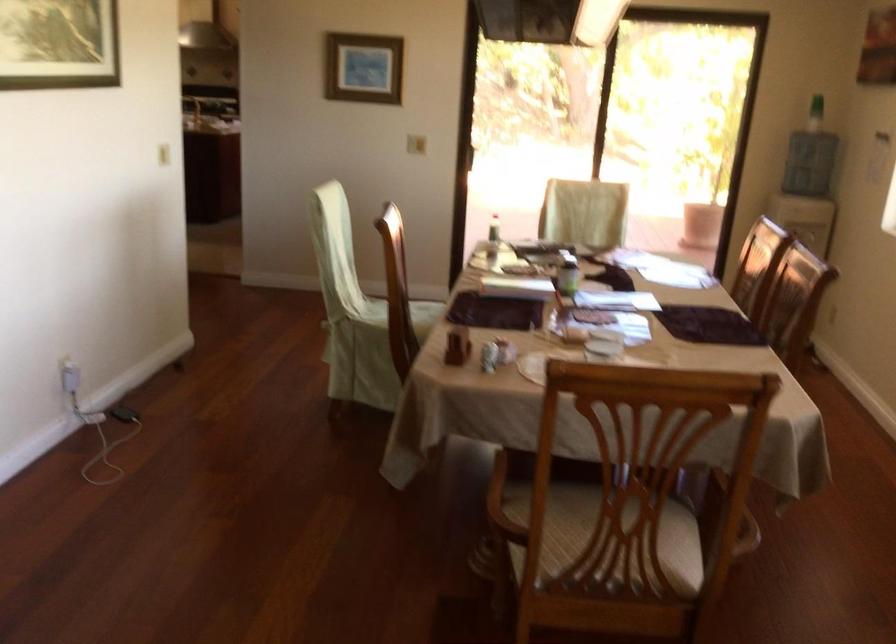
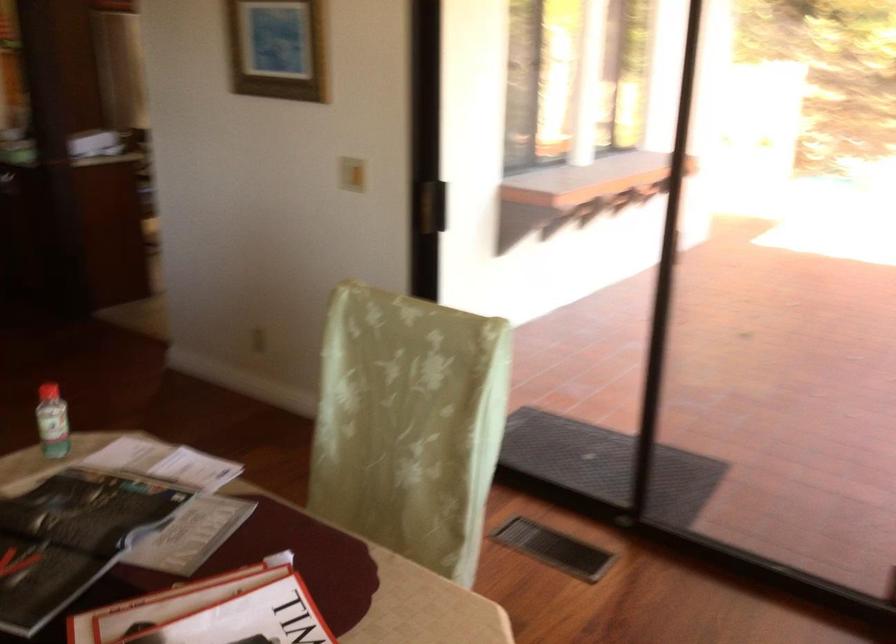
In a continuous first-person perspective shot, in which direction is the camera moving?

The movement direction of the cameraman is right, forward.